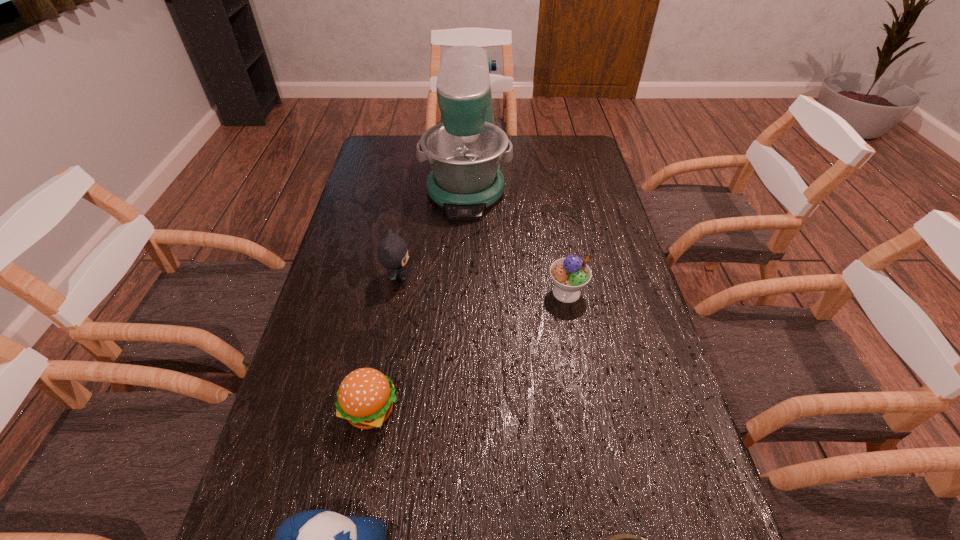
Image resolution: width=960 pixels, height=540 pixels. Find the location of `kitten located at the left edge`. kitten located at the left edge is located at coordinates (392, 252).

Locate an element on the screen. hamburger at the left edge is located at coordinates (365, 397).

At what (x,y) coordinates should I click in order to perform the action: click on object that is at the right edge. Please return your answer as a coordinate pair (x, y). Image resolution: width=960 pixels, height=540 pixels. Looking at the image, I should click on (571, 274).

Where is `free space at the left edge of the desktop`? The height and width of the screenshot is (540, 960). free space at the left edge of the desktop is located at coordinates tap(294, 492).

Where is `free space at the right edge of the desktop`? This screenshot has height=540, width=960. free space at the right edge of the desktop is located at coordinates (624, 449).

In the image, there is a desktop. Identify the location of vacant space at the far right corner. (580, 137).

Locate an element on the screen. This screenshot has width=960, height=540. free space between the kitten and the icecream is located at coordinates (482, 285).

Locate an element on the screen. The width and height of the screenshot is (960, 540). unoccupied position between the mixer and the hamburger is located at coordinates (419, 292).

Where is `vacant space that is in between the kitten and the fourth farthest object`? vacant space that is in between the kitten and the fourth farthest object is located at coordinates [x=385, y=343].

The image size is (960, 540). I want to click on empty space between the kitten and the farthest object, so click(432, 225).